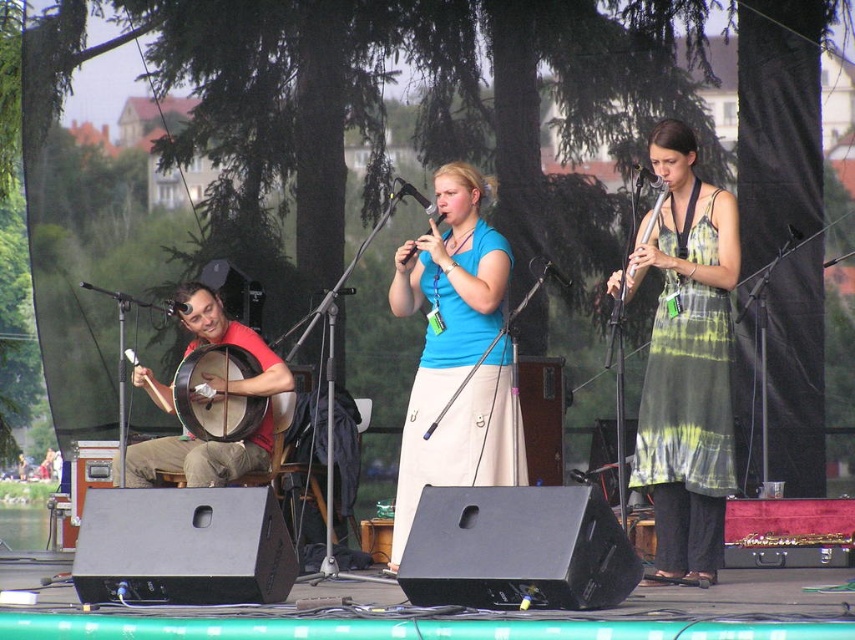
Which is in front, point (128, 467) or point (632, 275)?

Point (632, 275) is in front.

Who is higher up, matte red banjo at left or wooden flute at right?

wooden flute at right is above.

Does point (201, 285) come closer to viewer compared to point (628, 291)?

No, it is behind (628, 291).

You are a GUI agent. You are given a task and a screenshot of the screen. Output one action in this format:
    pyautogui.click(x=<x>, y=<y>)
    Task: Click on the matte red banjo at left
    The image size is (855, 640).
    Given the screenshot: What is the action you would take?
    pyautogui.click(x=199, y=458)

Can you confirm if matte blue shirt at center is wider than matte red banjo at left?

No, matte blue shirt at center is not wider than matte red banjo at left.

This screenshot has width=855, height=640. I want to click on matte blue shirt at center, so click(455, 353).

The height and width of the screenshot is (640, 855). I want to click on matte blue shirt at center, so [455, 353].

Between matte blue shirt at center and wooden flute at right, which one has less height?

wooden flute at right

In order to click on matte blue shirt at center in this screenshot , I will do `click(455, 353)`.

Find the location of a particular element. matte blue shirt at center is located at coordinates (455, 353).